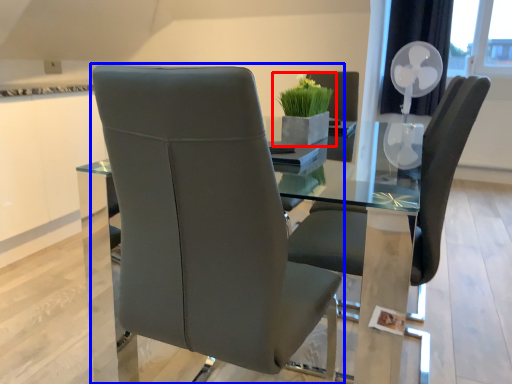
Question: Which point is further to the camera, houseplant (highlighted by a red box) or chair (highlighted by a blue box)?

Choices:
 (A) houseplant
 (B) chair

Answer: (A)